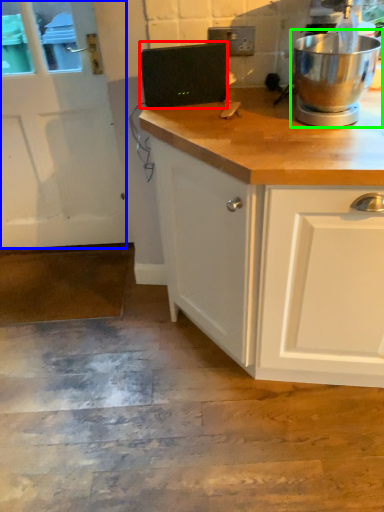
Question: Estimate the real-world distances between objects in this image. Which object is farther from appliance (highlighted by a red box), screen door (highlighted by a blue box) or home appliance (highlighted by a green box)?

Choices:
 (A) screen door
 (B) home appliance

Answer: (A)